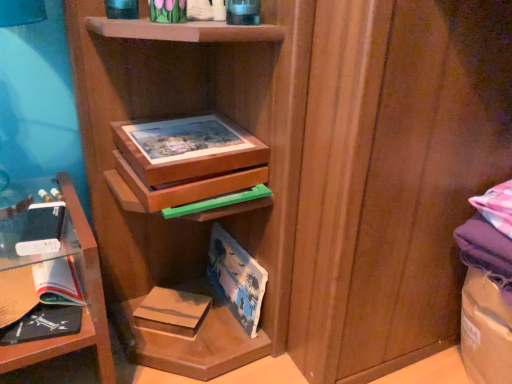
This screenshot has height=384, width=512. In order to click on vacant area that is in front of brown cardboard book at lower center, the 2th paperback book when ordered from right to left in this screenshot , I will do `click(153, 369)`.